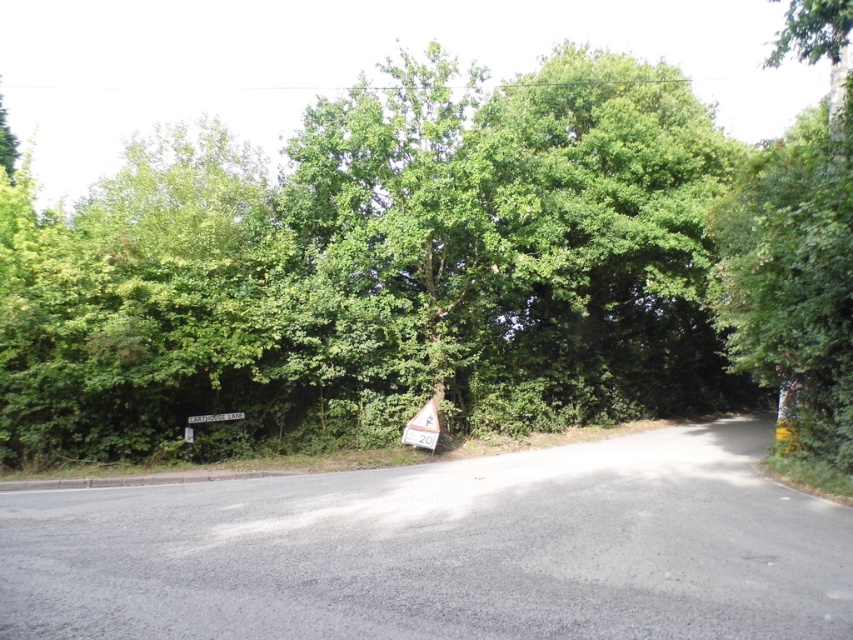
You are driving along the rural road and notice the green leafy tree at center. If you want to park your car on the side of the road, which side of the road should you choose to avoid blocking the view of the tree?

The green leafy tree at center is located at point (x=434, y=272), so you should park on the side opposite to the tree to avoid blocking the view of it.

You are standing on the rural road and see the green leafy tree at center. If you walk straight ahead, will you get closer to the tree?

The green leafy tree at center is 34.47 feet away from viewer. Walking straight ahead on the road, which curves gently to the right, may not directly approach the tree. However, since the tree is at the center, it might be along the path. But the distance given is from the viewer to the tree, so moving forward would reduce that distance, meaning you would get closer to the green leafy tree at center.

You are driving along the rural road and notice a triangular warning sign near the center right. There is a point marked at coordinates (434, 272). What object is located at that point?

The point at coordinates (434, 272) has a green leafy tree at center located there.